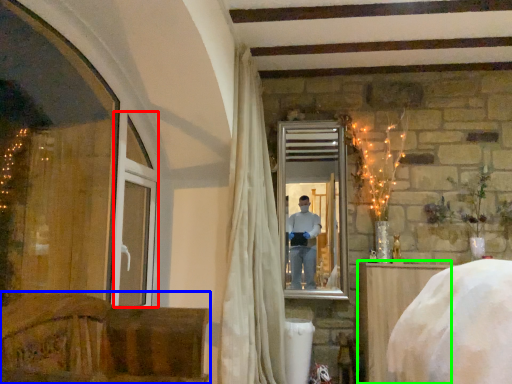
Question: Which object is positioned farthest from window frame (highlighted by a red box)? Select from furniture (highlighted by a blue box) and furniture (highlighted by a green box).

Choices:
 (A) furniture
 (B) furniture

Answer: (B)